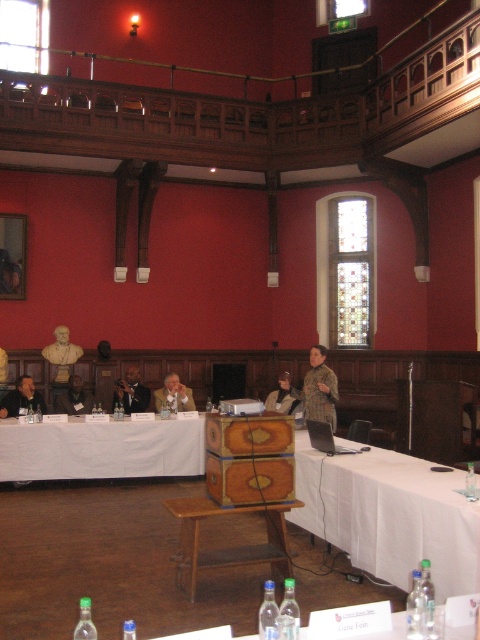
Question: Considering the relative positions of matte black jacket at left and light brown wooden chair at center in the image provided, where is matte black jacket at left located with respect to light brown wooden chair at center?

Choices:
 (A) above
 (B) below

Answer: (B)

Question: Can you confirm if white cloth-covered table at center is smaller than matte black suit at center?

Choices:
 (A) yes
 (B) no

Answer: (B)

Question: Can you confirm if white cloth-covered table at center is smaller than white cloth at lower left?

Choices:
 (A) no
 (B) yes

Answer: (A)

Question: Which point appears closest to the camera in this image?

Choices:
 (A) (130, 397)
 (B) (16, 406)
 (C) (314, 387)
 (D) (69, 353)

Answer: (C)

Question: Among these points, which one is farthest from the camera?

Choices:
 (A) (75, 356)
 (B) (412, 490)
 (C) (282, 381)
 (D) (75, 394)

Answer: (A)

Question: Estimate the real-world distances between objects in this image. Which object is closer to the dark brown leather jacket at center?

Choices:
 (A) light brown wooden chair at center
 (B) golden bust at left

Answer: (B)